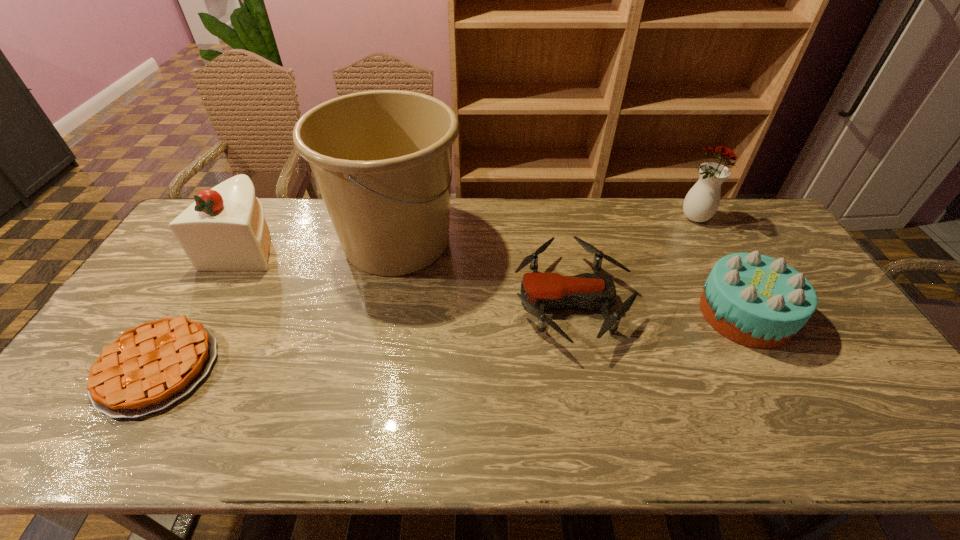
Locate an element on the screen. The height and width of the screenshot is (540, 960). vacant space located on the left of the third object from left to right is located at coordinates (252, 241).

Locate an element on the screen. free space located on the left of the vase is located at coordinates (581, 219).

Locate an element on the screen. The width and height of the screenshot is (960, 540). vacant area situated on the left of the taller cake is located at coordinates (175, 244).

The height and width of the screenshot is (540, 960). Find the location of `vacant region located 0.170m on the left of the right cake`. vacant region located 0.170m on the left of the right cake is located at coordinates (640, 314).

Find the location of a particular element. This screenshot has width=960, height=540. vacant area located 0.060m on the front-facing side of the drone is located at coordinates (493, 301).

Identify the location of vacant position located on the front-facing side of the drone. The height and width of the screenshot is (540, 960). (439, 301).

Image resolution: width=960 pixels, height=540 pixels. What are the coordinates of `vacant point located 0.360m on the front-facing side of the drone` in the screenshot? It's located at (391, 301).

Where is `free spot located 0.150m on the back of the pie`? Image resolution: width=960 pixels, height=540 pixels. free spot located 0.150m on the back of the pie is located at coordinates (208, 285).

Where is `bucket present at the far edge`? bucket present at the far edge is located at coordinates (381, 159).

You are a GUI agent. You are given a task and a screenshot of the screen. Output one action in this format:
    pyautogui.click(x=<x>, y=<y>)
    Task: Click on the vase located at the far edge
    This screenshot has width=960, height=540.
    Given the screenshot: What is the action you would take?
    [x=702, y=201]